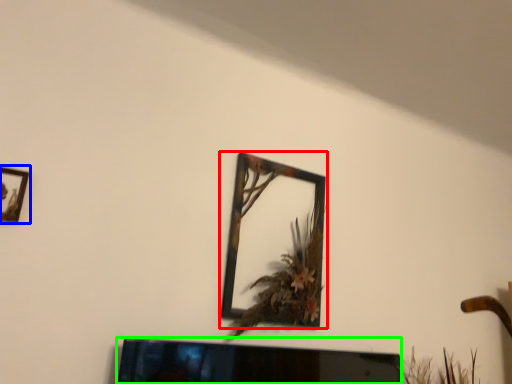
Question: Based on their relative distances, which object is farther from picture frame (highlighted by a red box)? Choose from picture frame (highlighted by a blue box) and television (highlighted by a green box).

Choices:
 (A) picture frame
 (B) television

Answer: (A)